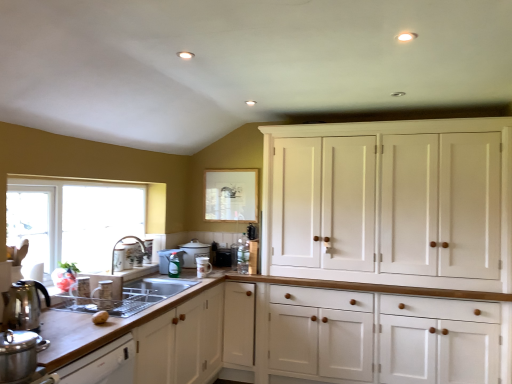
Find the location of `vacant space in between shiny metallic kettle at left and brown matte potato at lower left`. vacant space in between shiny metallic kettle at left and brown matte potato at lower left is located at coordinates (68, 321).